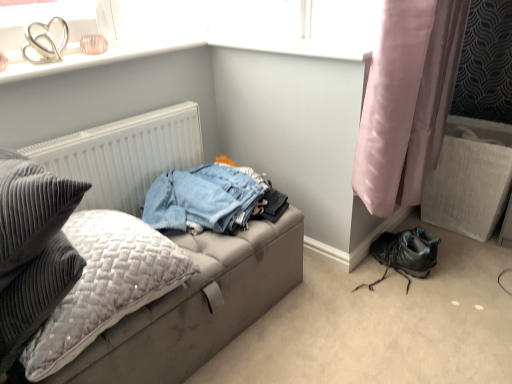
Measure the distance between point (198, 258) and camera.

The depth of point (198, 258) is 4.27 feet.

Where is `velvet grey pillow at left`? This screenshot has height=384, width=512. velvet grey pillow at left is located at coordinates (105, 284).

Is white textured radiator at upper left closer to the viewer compared to leatherette studio couch at left?

No, the depth of white textured radiator at upper left is greater than that of leatherette studio couch at left.

From a real-world perspective, is white textured radiator at upper left positioned above or below leatherette studio couch at left?

From a real-world perspective, white textured radiator at upper left is physically above leatherette studio couch at left.

In terms of size, does white textured radiator at upper left appear bigger or smaller than leatherette studio couch at left?

Clearly, white textured radiator at upper left is smaller in size than leatherette studio couch at left.

Based on the photo, in terms of width, does white textured radiator at upper left look wider or thinner when compared to leatherette studio couch at left?

white textured radiator at upper left is thinner than leatherette studio couch at left.

Identify the location of studio couch on the right of white textured radiator at upper left. pyautogui.click(x=197, y=307).

Consider the image. Considering the relative sizes of leatherette studio couch at left and white textured radiator at upper left in the image provided, is leatherette studio couch at left thinner than white textured radiator at upper left?

In fact, leatherette studio couch at left might be wider than white textured radiator at upper left.

Are leatherette studio couch at left and white textured radiator at upper left far apart?

Actually, leatherette studio couch at left and white textured radiator at upper left are a little close together.

Considering the sizes of objects white textured radiator at upper left and velvet grey pillow at left in the image provided, who is thinner, white textured radiator at upper left or velvet grey pillow at left?

With smaller width is white textured radiator at upper left.

From the image's perspective, is white textured radiator at upper left on top of velvet grey pillow at left?

Yes, from the image's perspective, white textured radiator at upper left is over velvet grey pillow at left.

The height and width of the screenshot is (384, 512). I want to click on radiator that is behind the velvet grey pillow at left, so click(x=125, y=155).

From the picture: From a real-world perspective, is white textured radiator at upper left beneath velvet grey pillow at left?

No, from a real-world perspective, white textured radiator at upper left is not below velvet grey pillow at left.

Considering the relative sizes of pink satin curtain at lower right and velvet grey pillow at left in the image provided, is pink satin curtain at lower right bigger than velvet grey pillow at left?

Indeed, pink satin curtain at lower right has a larger size compared to velvet grey pillow at left.

Is point (439, 128) positioned after point (103, 304)?

Yes, point (439, 128) is farther from viewer.

Is velvet grey pillow at left inside pink satin curtain at lower right?

No, velvet grey pillow at left is located outside of pink satin curtain at lower right.

Would you say leatherette studio couch at left is to the left or to the right of velvet grey pillow at left in the picture?

leatherette studio couch at left is positioned on velvet grey pillow at left's right side.

Looking at this image, from the image's perspective, is leatherette studio couch at left located beneath velvet grey pillow at left?

Yes, from the image's perspective, leatherette studio couch at left is below velvet grey pillow at left.

Which of these two, leatherette studio couch at left or velvet grey pillow at left, is wider?

With larger width is leatherette studio couch at left.

Where is `pillow on the left side of leatherette studio couch at left`? pillow on the left side of leatherette studio couch at left is located at coordinates (105, 284).

Which of these two, white textured radiator at upper left or clear glass heart at upper left, is wider?

clear glass heart at upper left.

From the image's perspective, is white textured radiator at upper left on top of clear glass heart at upper left?

Actually, white textured radiator at upper left appears below clear glass heart at upper left in the image.

Based on their sizes in the image, would you say white textured radiator at upper left is bigger or smaller than clear glass heart at upper left?

Clearly, white textured radiator at upper left is larger in size than clear glass heart at upper left.

Can you confirm if matte black shoe at lower right is positioned to the right of velvet grey pillow at left?

Yes.

Who is shorter, matte black shoe at lower right or velvet grey pillow at left?

velvet grey pillow at left is shorter.

Who is smaller, matte black shoe at lower right or velvet grey pillow at left?

Smaller between the two is matte black shoe at lower right.

Which is farther from the camera, (384, 276) or (120, 278)?

Positioned behind is point (384, 276).

I want to click on radiator located above the leatherette studio couch at left (from the image's perspective), so click(x=125, y=155).

At what (x,y) coordinates should I click in order to perform the action: click on studio couch that appears below the white textured radiator at upper left (from a real-world perspective). Please return your answer as a coordinate pair (x, y). The width and height of the screenshot is (512, 384). Looking at the image, I should click on (197, 307).

When comparing their distances from velvet grey pillow at left, does matte black shoe at lower right or white textured radiator at upper left seem further?

Among the two, matte black shoe at lower right is located further to velvet grey pillow at left.

Considering their positions, is clear glass heart at upper left positioned further to leatherette studio couch at left than velvet grey pillow at left?

clear glass heart at upper left is positioned further to the anchor leatherette studio couch at left.

Which object lies nearer to the anchor point clear glass heart at upper left, white textured radiator at upper left or matte black shoe at lower right?

white textured radiator at upper left.

When comparing their distances from white textured radiator at upper left, does clear glass heart at upper left or velvet grey pillow at left seem closer?

Among the two, clear glass heart at upper left is located nearer to white textured radiator at upper left.

Estimate the real-world distances between objects in this image. Which object is closer to clear glass heart at upper left, pink satin curtain at lower right or velvet grey pillow at left?

Among the two, velvet grey pillow at left is located nearer to clear glass heart at upper left.

Estimate the real-world distances between objects in this image. Which object is further from white textured radiator at upper left, velvet grey pillow at left or clear glass heart at upper left?

Based on the image, velvet grey pillow at left appears to be further to white textured radiator at upper left.

Considering their positions, is clear glass heart at upper left positioned further to pink satin curtain at lower right than leatherette studio couch at left?

clear glass heart at upper left is positioned further to the anchor pink satin curtain at lower right.

Estimate the real-world distances between objects in this image. Which object is closer to white textured radiator at upper left, pink satin curtain at lower right or velvet grey pillow at left?

velvet grey pillow at left lies closer to white textured radiator at upper left than the other object.

This screenshot has width=512, height=384. Find the location of `radiator between clear glass heart at upper left and matte black shoe at lower right`. radiator between clear glass heart at upper left and matte black shoe at lower right is located at coordinates (125, 155).

The height and width of the screenshot is (384, 512). I want to click on radiator situated between velvet grey pillow at left and pink satin curtain at lower right from left to right, so click(x=125, y=155).

I want to click on radiator situated between clear glass heart at upper left and pink satin curtain at lower right from left to right, so click(125, 155).

Locate an element on the screen. studio couch between white textured radiator at upper left and pink satin curtain at lower right is located at coordinates (197, 307).